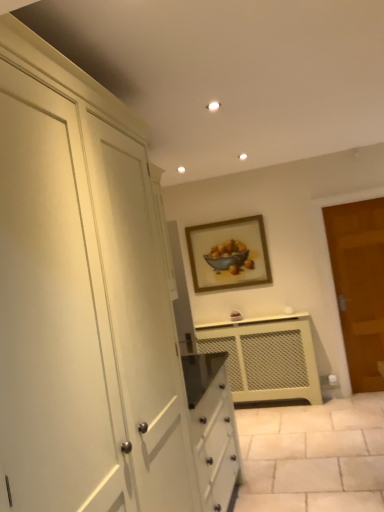
I want to click on vacant region above brown wooden door at right (from a real-world perspective), so click(349, 187).